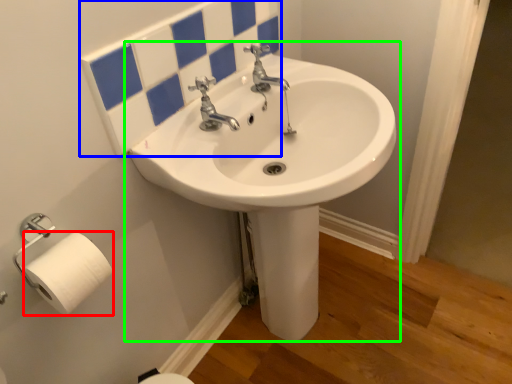
Question: Considering the real-world distances, which object is closest to toilet paper (highlighted by a red box)? mirror (highlighted by a blue box) or sink (highlighted by a green box).

Choices:
 (A) mirror
 (B) sink

Answer: (A)